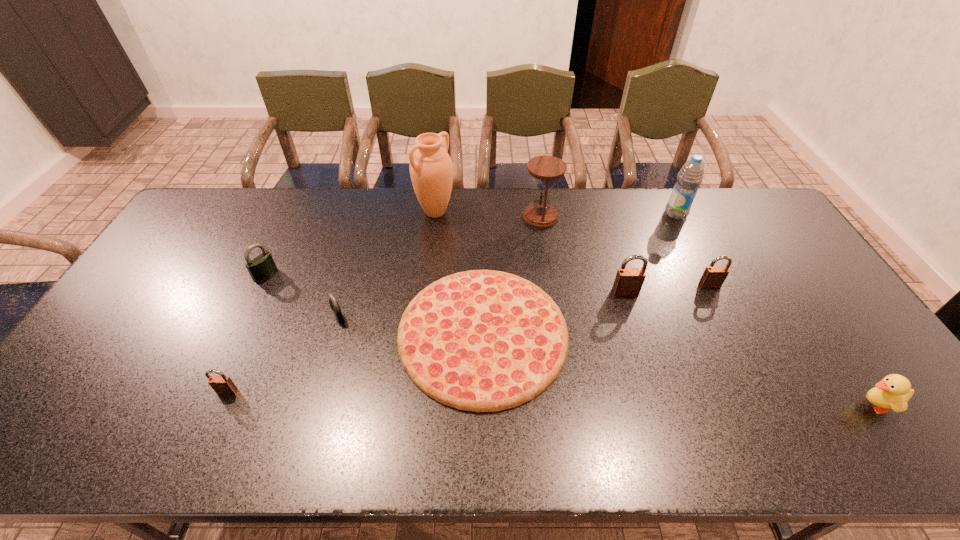
Locate an element on the screen. The width and height of the screenshot is (960, 540). the tallest object is located at coordinates (431, 169).

Locate an element on the screen. This screenshot has height=540, width=960. blue water bottle is located at coordinates (690, 176).

The height and width of the screenshot is (540, 960). I want to click on hourglass, so click(x=546, y=169).

Image resolution: width=960 pixels, height=540 pixels. I want to click on the tallest padlock, so click(628, 282).

I want to click on the fourth tallest object, so click(628, 282).

The height and width of the screenshot is (540, 960). I want to click on the second smallest brown padlock, so click(714, 276).

Where is `the rightmost brown padlock`? This screenshot has height=540, width=960. the rightmost brown padlock is located at coordinates (714, 276).

Where is `the left black padlock`? The width and height of the screenshot is (960, 540). the left black padlock is located at coordinates (262, 266).

Locate an element on the screen. This screenshot has width=960, height=540. the farther black padlock is located at coordinates (262, 266).

Locate an element on the screen. This screenshot has height=540, width=960. the rightmost object is located at coordinates (893, 392).